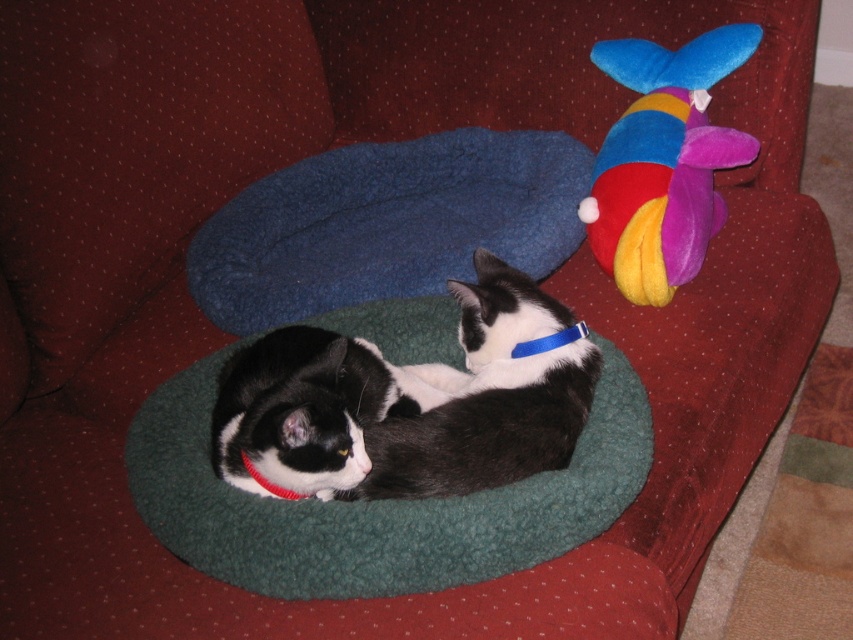
You are a cat owner observing your cats in the image. You notice both cats have collars. Which cat with black and white fur at center is positioned to the left of the blue fabric neckband at center?

The black and white fur at center is to the left of blue fabric neckband at center.

You are a cat owner who wants to place a new toy for your cats. The cats are currently resting on the green fleece cat bed at center. Where should you place the new toy so that it is not too close to the cats?

The green fleece cat bed at center is located at point [376,502]. To avoid placing the new toy too close to the cats, you should position it away from this coordinate, perhaps to the left or right side of the bed.

You are looking at the two cats in the image. The first cat is at point (512,374) and the second cat is at point (541,346). Which cat is closer to you?

The cat at point (512,374) is closer to you than the cat at point (541,346).